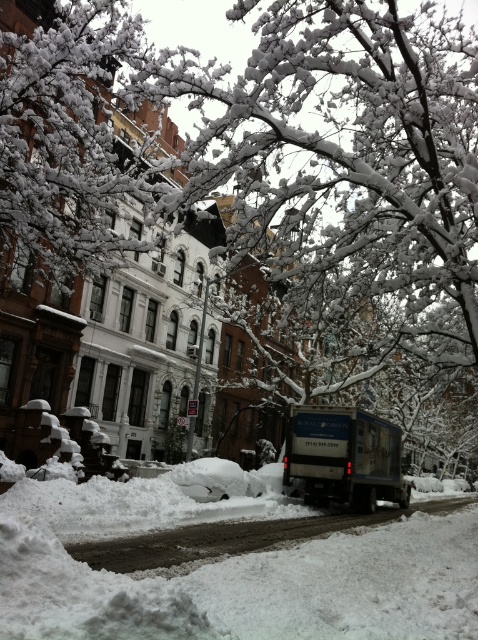
You are a pedestrian standing on the sidewalk and want to cross the road to reach the buildings. Which object, the white fluffy snow at lower left or the blue metallic truck at center, is closer to you as you prepare to step onto the road?

The white fluffy snow at lower left is closer to you because it is in front of the blue metallic truck at center, meaning it is nearer to your position on the sidewalk.

You are a delivery driver who needs to park your blue metallic truck at center near the curb. There is white fluffy snow at lower left in the parking area. Can you park your truck there without covering the snow completely?

The white fluffy snow at lower left is bigger than the blue metallic truck at center, so there is enough space to park the blue metallic truck at center without covering the snow completely.

You are a delivery person who needs to park the blue metallic truck at center near the white fluffy snow at lower left. Can you safely park the truck there without blocking the sidewalk?

The white fluffy snow at lower left is not as tall as the blue metallic truck at center, so the truck can be parked there without blocking the sidewalk since the snow is lower in height.